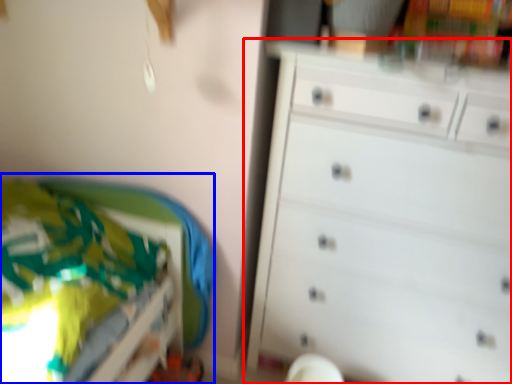
Question: Which object appears farthest to the camera in this image, chest of drawers (highlighted by a red box) or bed (highlighted by a blue box)?

Choices:
 (A) chest of drawers
 (B) bed

Answer: (A)